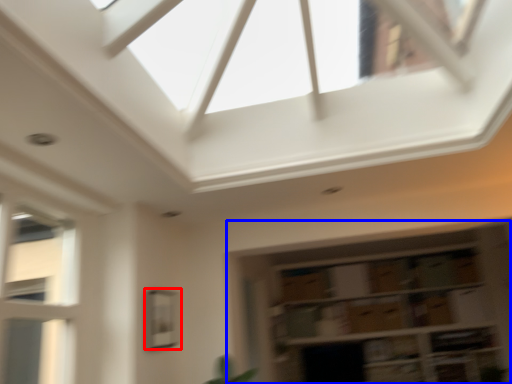
Question: Which object is further to the camera taking this photo, window (highlighted by a red box) or shelf (highlighted by a blue box)?

Choices:
 (A) window
 (B) shelf

Answer: (B)